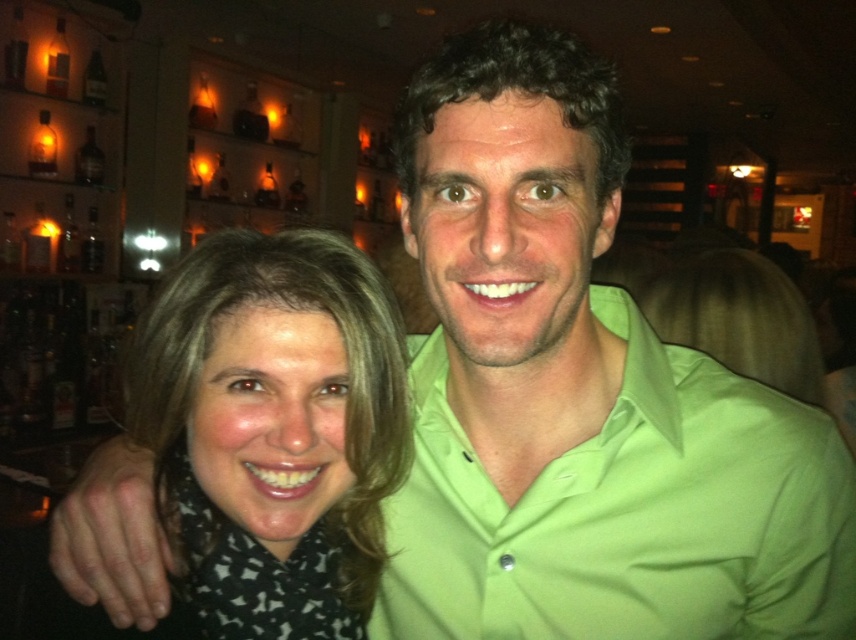
Question: Among these points, which one is farthest from the camera?

Choices:
 (A) (248, 467)
 (B) (425, 576)

Answer: (B)

Question: Is lime green polo shirt at center above matte black scarf at left?

Choices:
 (A) no
 (B) yes

Answer: (A)

Question: Is lime green polo shirt at center thinner than matte black scarf at left?

Choices:
 (A) no
 (B) yes

Answer: (A)

Question: Can you confirm if lime green polo shirt at center is smaller than matte black scarf at left?

Choices:
 (A) no
 (B) yes

Answer: (A)

Question: Which point is farther to the camera?

Choices:
 (A) lime green polo shirt at center
 (B) matte black scarf at left

Answer: (A)

Question: Which of the following is the farthest from the observer?

Choices:
 (A) (352, 253)
 (B) (431, 552)

Answer: (B)